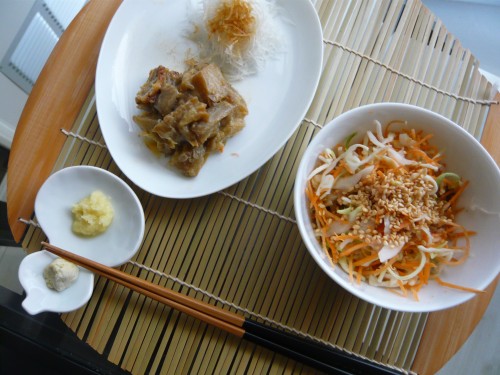
Find the location of a particular element. bowl is located at coordinates (475, 157).